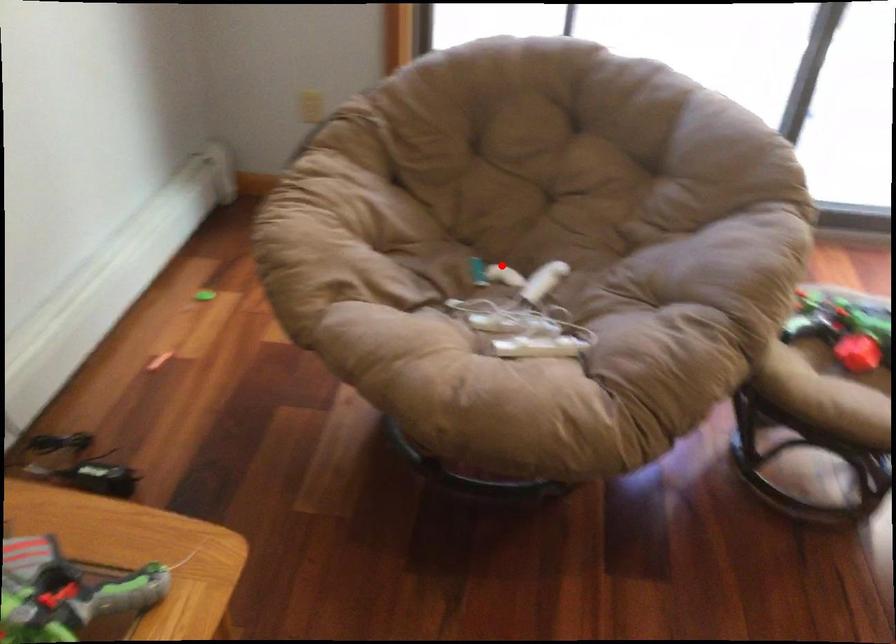
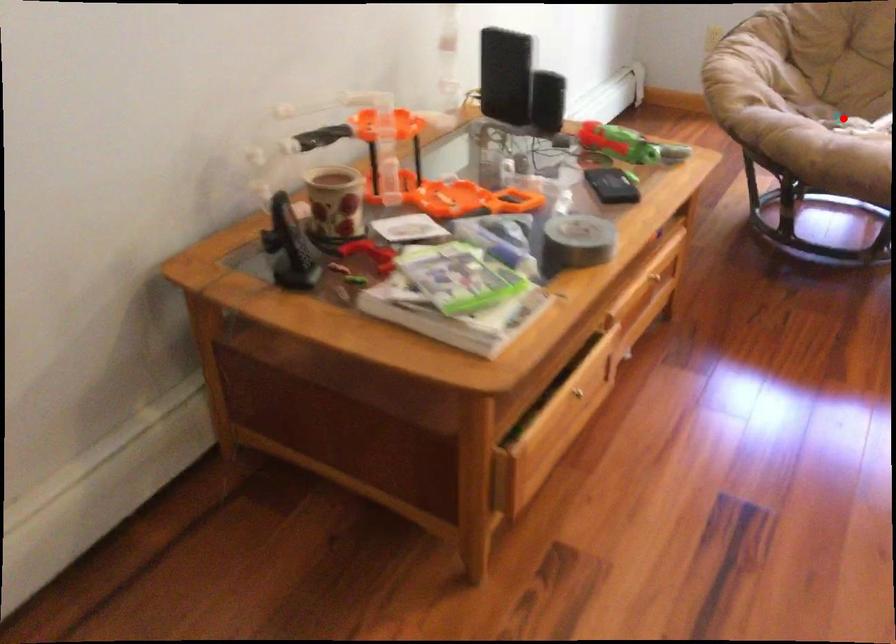
I am providing you with two images of the same scene from different viewpoints. A red point is marked on the first image and another point is marked on the second image. Is the marked point in image1 the same physical position as the marked point in image2?

Yes